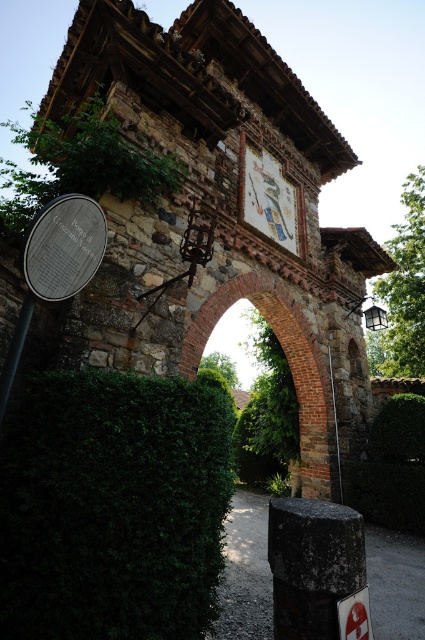
You are a tourist standing in front of the historic stone archway. You see the silver metallic sign at left and the black matte pole at lower left. Which object is located to the right of the other?

The silver metallic sign at left is positioned on the right side of the black matte pole at lower left, so the silver metallic sign at left is to the right of the black matte pole at lower left.

Based on the photo, you are a visitor standing at the base of the historic stone archway and notice two objects near your feet. The white plastic sign at lower right and the black matte pole at lower left. Which object is closer to the ground?

The white plastic sign at lower right is located below the black matte pole at lower left, so it is closer to the ground.

You are a construction worker assessing the structural integrity of the scene. The black matte pole at lower left and the smooth stone post at center are both supporting parts of the archway. Which object has a greater width?

The black matte pole at lower left has a greater width than the smooth stone post at center, as stated in the description that its width surpasses the latter.